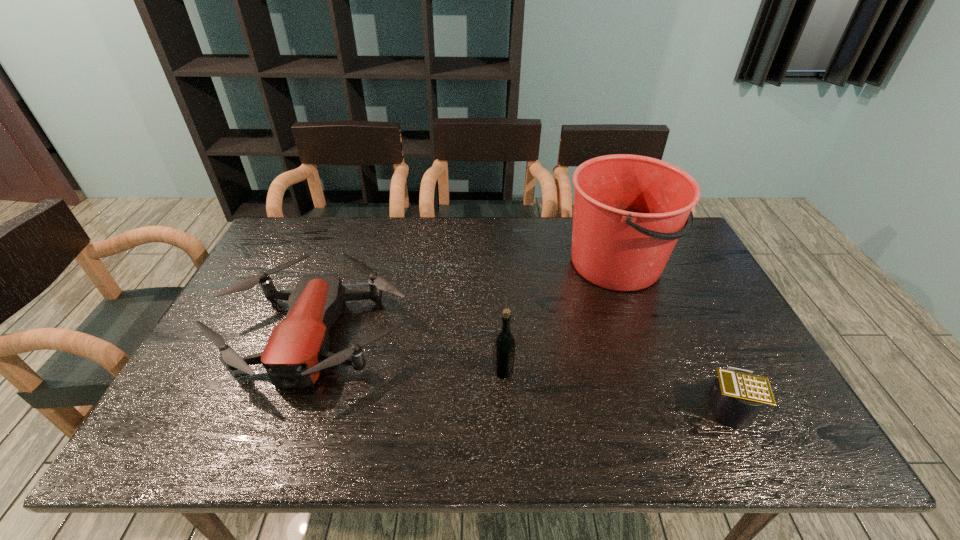
Image resolution: width=960 pixels, height=540 pixels. I want to click on vacant area between the bucket and the calculator, so click(x=672, y=335).

Locate an element on the screen. This screenshot has height=540, width=960. free spot between the calculator and the beer bottle is located at coordinates (615, 388).

Where is `object that can be found as the closest to the leftmost object`? object that can be found as the closest to the leftmost object is located at coordinates (504, 346).

Point out which object is positioned as the third nearest to the calculator. Please provide its 2D coordinates. Your answer should be formatted as a tuple, i.e. [(x, y)], where the tuple contains the x and y coordinates of a point satisfying the conditions above.

[(297, 350)]

Identify the location of vacant region that satisfies the following two spatial constraints: 1. on the front-facing side of the third object from right to left; 2. on the right side of the leftmost object. (300, 371).

Locate an element on the screen. free location that satisfies the following two spatial constraints: 1. on the front-facing side of the leftmost object; 2. on the left side of the calculator is located at coordinates (287, 406).

You are a GUI agent. You are given a task and a screenshot of the screen. Output one action in this format:
    pyautogui.click(x=<x>, y=<y>)
    Task: Click on the vacant space that satisfies the following two spatial constraints: 1. on the front-facing side of the calculator; 2. on the left side of the leftmost object
    The image size is (960, 540).
    Given the screenshot: What is the action you would take?
    pyautogui.click(x=287, y=406)

Find the location of `free space in the image that satisfies the following two spatial constraints: 1. on the front-facing side of the calculator; 2. on the right side of the drone`. free space in the image that satisfies the following two spatial constraints: 1. on the front-facing side of the calculator; 2. on the right side of the drone is located at coordinates (287, 406).